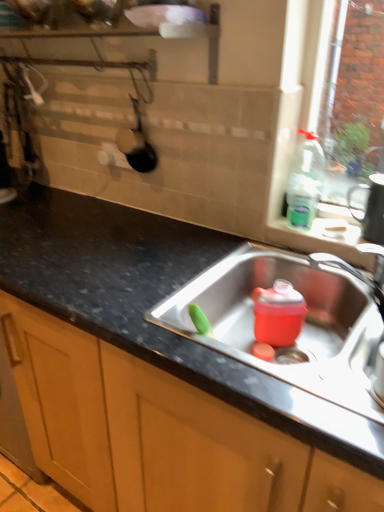
I want to click on vacant area situated to the left side of black matte mug at upper right, so click(x=313, y=225).